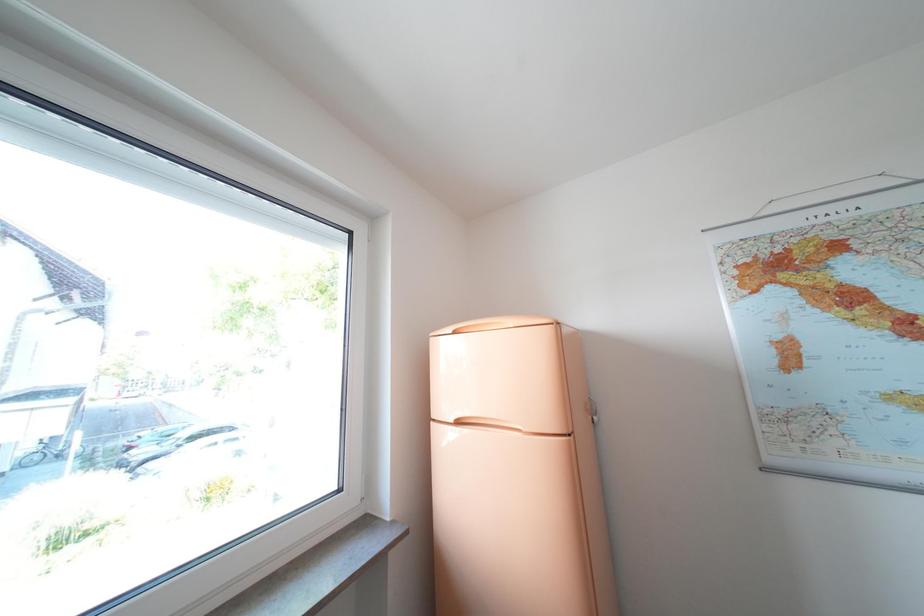
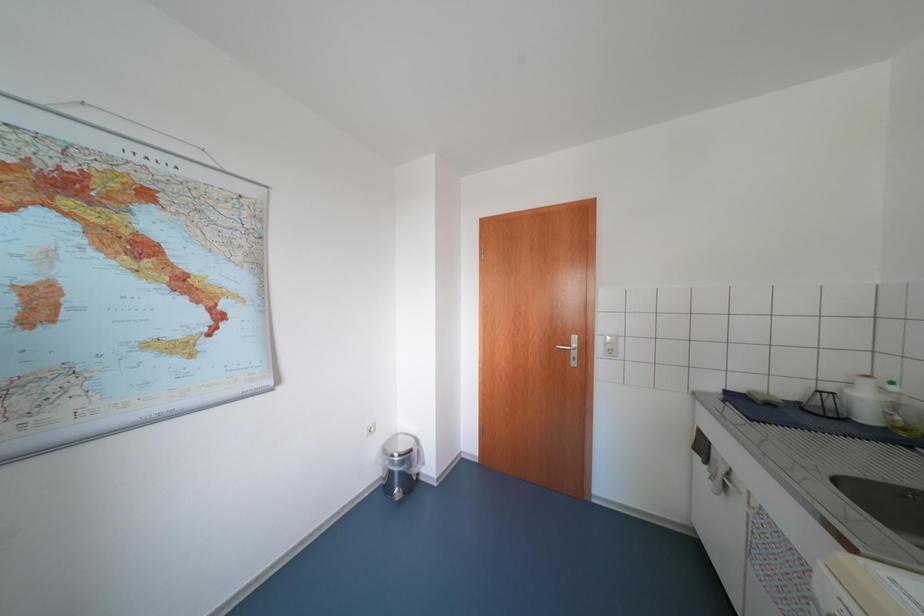
Question: How did the camera likely rotate?

Choices:
 (A) Left
 (B) Right
 (C) Up
 (D) Down

Answer: (B)